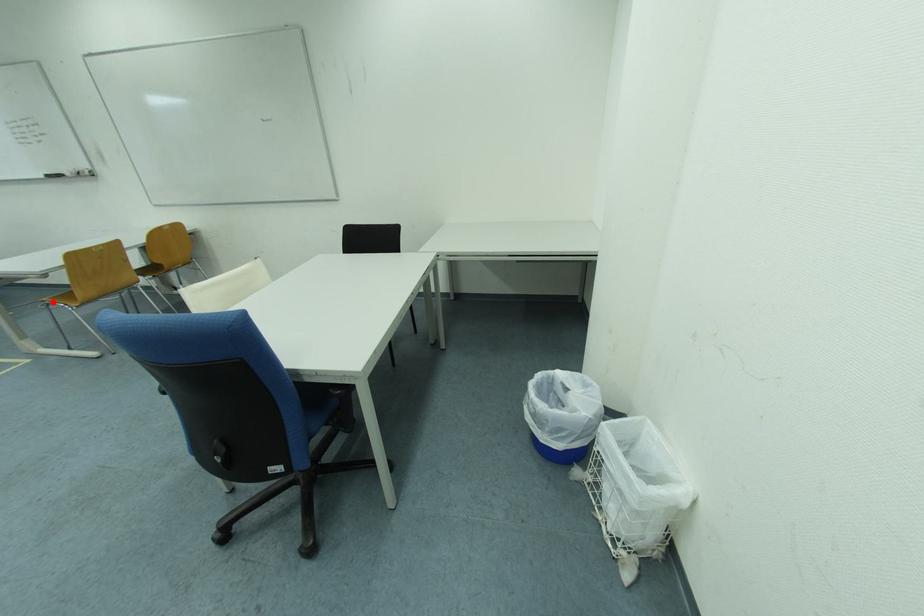
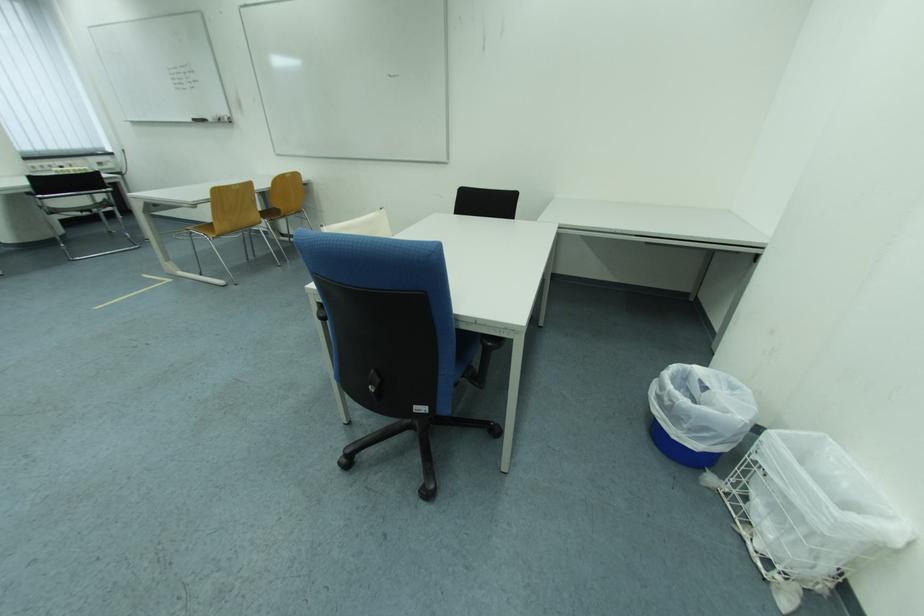
In the second image, find the point that corresponds to the highlighted location in the first image.

(197, 231)